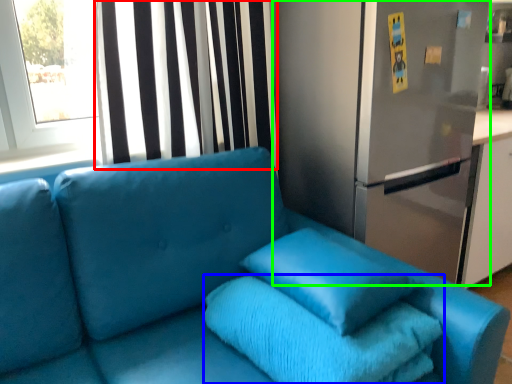
Question: Which is farther away from curtain (highlighted by a red box)? bath towel (highlighted by a blue box) or fridge (highlighted by a green box)?

Choices:
 (A) bath towel
 (B) fridge

Answer: (A)